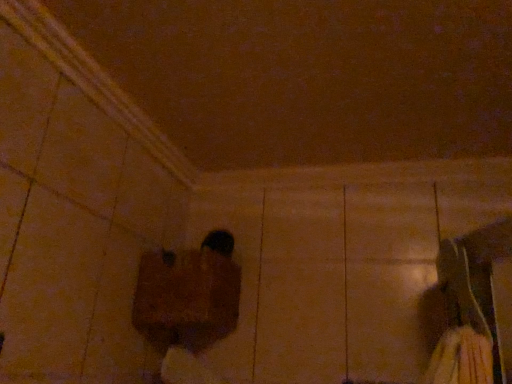
This screenshot has width=512, height=384. What do you see at coordinates (187, 306) in the screenshot?
I see `wooden block at lower center` at bounding box center [187, 306].

I want to click on wooden block at lower center, so click(x=187, y=306).

In order to face wooden block at lower center, should I rotate leftwards or rightwards?

You should look left and rotate roughly 8.443 degrees.

What do you see at coordinates (219, 242) in the screenshot? I see `black matte shoe at center` at bounding box center [219, 242].

At what (x,y) coordinates should I click in order to perform the action: click on black matte shoe at center. Please return your answer as a coordinate pair (x, y). Looking at the image, I should click on (219, 242).

The width and height of the screenshot is (512, 384). Find the location of `wooden block at lower center`. wooden block at lower center is located at coordinates (187, 306).

Can you confirm if wooden block at lower center is positioned to the left of black matte shoe at center?

Correct, you'll find wooden block at lower center to the left of black matte shoe at center.

In the image, is wooden block at lower center positioned in front of or behind black matte shoe at center?

wooden block at lower center is positioned closer to the viewer than black matte shoe at center.

Is point (215, 253) behind point (222, 231)?

No.

From the image's perspective, would you say wooden block at lower center is positioned over black matte shoe at center?

No, from the image's perspective, wooden block at lower center is not above black matte shoe at center.

From a real-world perspective, is wooden block at lower center over black matte shoe at center?

No.

Does wooden block at lower center have a greater width compared to black matte shoe at center?

Yes, wooden block at lower center is wider than black matte shoe at center.

In the scene shown: Is wooden block at lower center shorter than black matte shoe at center?

Incorrect, the height of wooden block at lower center does not fall short of that of black matte shoe at center.

Which of these two, wooden block at lower center or black matte shoe at center, is bigger?

wooden block at lower center.

Would you say wooden block at lower center contains black matte shoe at center?

That's incorrect, black matte shoe at center is not inside wooden block at lower center.

Is there a large distance between wooden block at lower center and black matte shoe at center?

wooden block at lower center is near black matte shoe at center, not far away.

Does wooden block at lower center turn towards black matte shoe at center?

No, wooden block at lower center is not oriented towards black matte shoe at center.

Looking at this image, how much distance is there between wooden block at lower center and black matte shoe at center?

A distance of 7.75 inches exists between wooden block at lower center and black matte shoe at center.

Image resolution: width=512 pixels, height=384 pixels. What are the coordinates of `person below the black matte shoe at center (from a real-world perspective)` in the screenshot? It's located at (187, 306).

Which is more to the right, black matte shoe at center or wooden block at lower center?

black matte shoe at center is more to the right.

Is the depth of black matte shoe at center less than that of wooden block at lower center?

No.

Considering the points (227, 238) and (191, 329), which point is in front, point (227, 238) or point (191, 329)?

The point (191, 329) is closer.

From the image's perspective, between black matte shoe at center and wooden block at lower center, which one is located above?

black matte shoe at center appears higher in the image.

Consider the image. From a real-world perspective, which object stands above the other?

From a 3D spatial view, black matte shoe at center is above.

Does black matte shoe at center have a greater width compared to wooden block at lower center?

Incorrect, the width of black matte shoe at center does not surpass that of wooden block at lower center.

Considering the sizes of black matte shoe at center and wooden block at lower center in the image, is black matte shoe at center taller or shorter than wooden block at lower center?

In the image, black matte shoe at center appears to be shorter than wooden block at lower center.

Does black matte shoe at center have a larger size compared to wooden block at lower center?

Incorrect, black matte shoe at center is not larger than wooden block at lower center.

Choose the correct answer: Is black matte shoe at center inside wooden block at lower center or outside it?

black matte shoe at center is outside wooden block at lower center.

Are black matte shoe at center and wooden block at lower center located far from each other?

black matte shoe at center is near wooden block at lower center, not far away.

Is wooden block at lower center at the back of black matte shoe at center?

black matte shoe at center is not turned away from wooden block at lower center.

How far apart are black matte shoe at center and wooden block at lower center?

black matte shoe at center and wooden block at lower center are 7.75 inches apart.

Locate an element on the screen. footwear that appears above the wooden block at lower center (from the image's perspective) is located at coordinates (219, 242).

The image size is (512, 384). There is a wooden block at lower center. What are the coordinates of `footwear above it (from a real-world perspective)` in the screenshot? It's located at 219,242.

Image resolution: width=512 pixels, height=384 pixels. Identify the location of person on the left of black matte shoe at center. (187, 306).